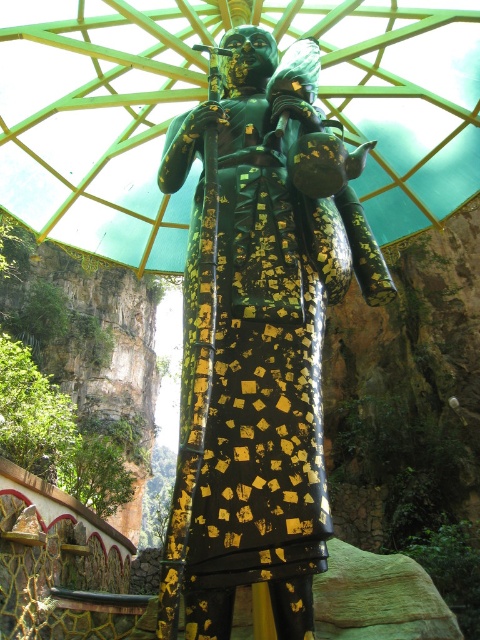
Consider the image. You are an architect designing a new garden pathway that needs to accommodate both the gold leafed statue at center and the green glossy umbrella at center. Since the statue is taller, how should you adjust the pathway design to ensure both are visible from a distance?

Since the gold leafed statue at center is taller than the green glossy umbrella at center, the pathway should be designed so that the statue is placed at a lower elevation or the umbrella is elevated slightly to ensure both are visible from a distance without one blocking the other.